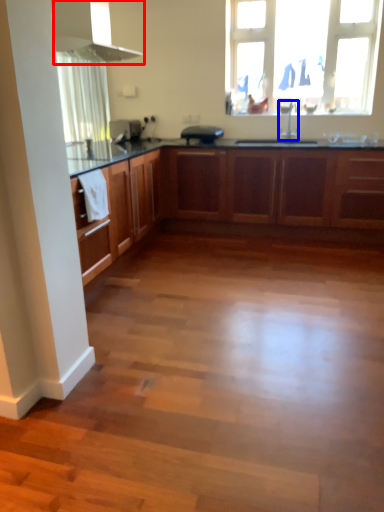
Question: Which object appears closest to the camera in this image, exhaust hood (highlighted by a red box) or tap (highlighted by a blue box)?

Choices:
 (A) exhaust hood
 (B) tap

Answer: (A)